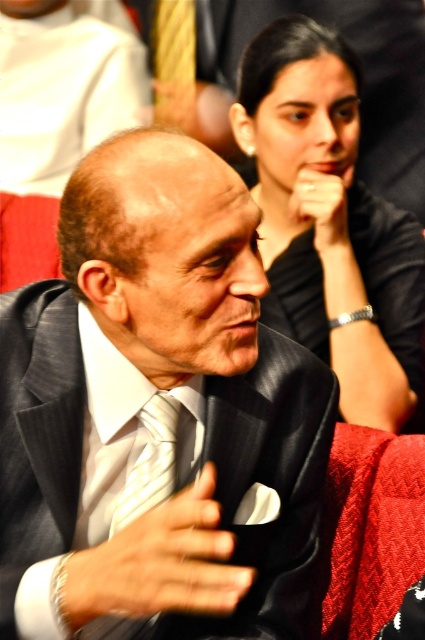
Question: Can you confirm if shiny black suit at center is positioned to the right of white striped tie at center?

Choices:
 (A) yes
 (B) no

Answer: (A)

Question: Which object is positioned farthest from the shiny black suit at center?

Choices:
 (A) white striped tie at center
 (B) black silk dress at upper right

Answer: (B)

Question: Which point appears farthest from the camera in this image?

Choices:
 (A) (167, 493)
 (B) (141, 506)
 (C) (346, 70)

Answer: (C)

Question: Where is shiny black suit at center located in relation to black silk dress at upper right in the image?

Choices:
 (A) right
 (B) left

Answer: (B)

Question: Does black silk dress at upper right have a lesser width compared to white striped tie at center?

Choices:
 (A) no
 (B) yes

Answer: (A)

Question: Which point is closer to the camera taking this photo?

Choices:
 (A) (14, 440)
 (B) (169, 428)

Answer: (A)